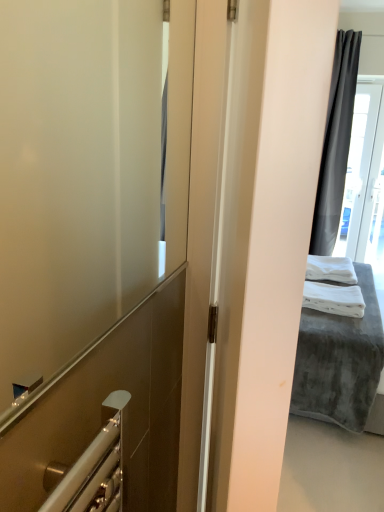
Question: Which is correct: white soft towel at right, the first bath towel positioned from the front, is inside transparent glass door at upper right, or outside of it?

Choices:
 (A) outside
 (B) inside

Answer: (A)

Question: Relative to transparent glass door at upper right, is white soft towel at right, the first bath towel positioned from the front, in front or behind?

Choices:
 (A) front
 (B) behind

Answer: (A)

Question: Considering the real-world distances, which object is closest to the white soft towel at right, the first bath towel positioned from the front?

Choices:
 (A) transparent glass door at upper right
 (B) white soft fabric bed at right
 (C) white soft bath towel at right, which is the first bath towel in back-to-front order

Answer: (B)

Question: Which of these objects is positioned farthest from the white soft bath towel at right, the second bath towel positioned from the front?

Choices:
 (A) white soft towel at right, the first bath towel positioned from the front
 (B) transparent glass door at upper right
 (C) white soft fabric bed at right

Answer: (B)